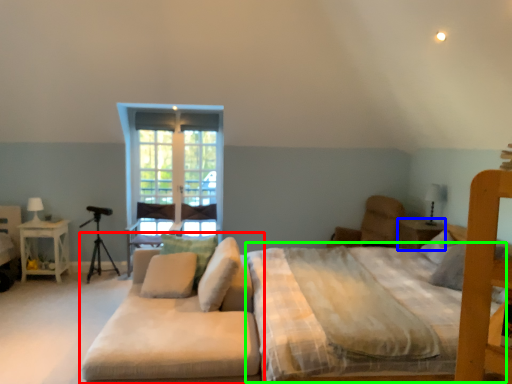
Question: Based on their relative distances, which object is nearer to studio couch (highlighted by a red box)? Choose from nightstand (highlighted by a blue box) and mattress (highlighted by a green box).

Choices:
 (A) nightstand
 (B) mattress

Answer: (B)